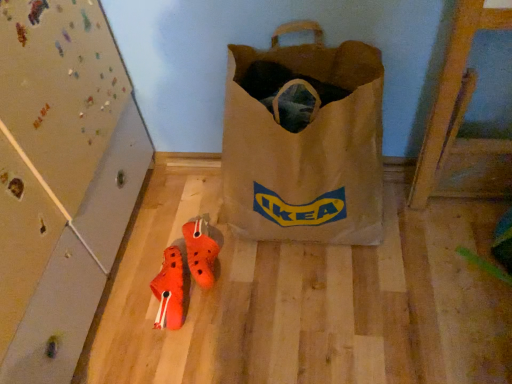
I want to click on vacant space in front of orange rubber clogs at center, the 2th footwear from the left, so click(209, 334).